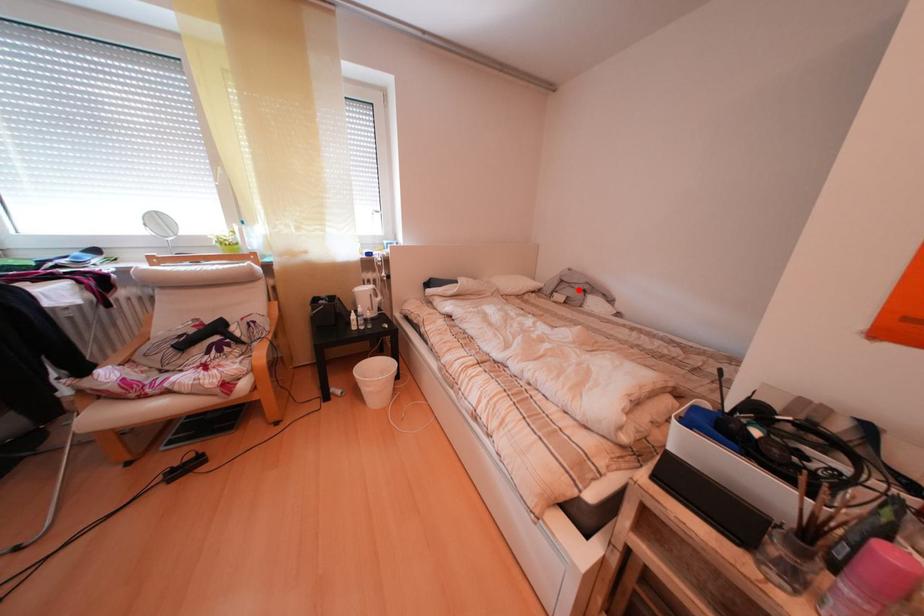
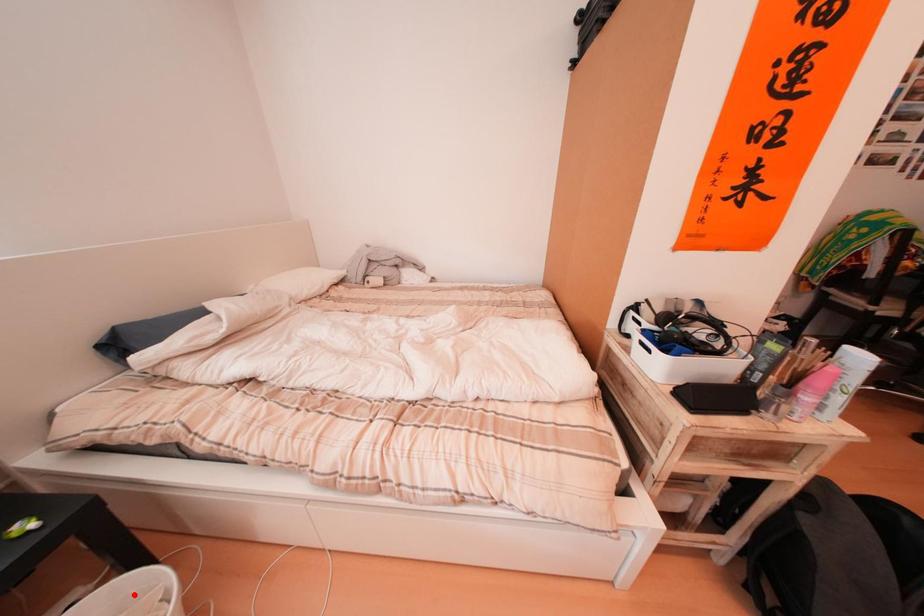
I am providing you with two images of the same scene from different viewpoints. A red point is marked on the first image and another point is marked on the second image. Is the red point in image1 aligned with the point shown in image2?

No